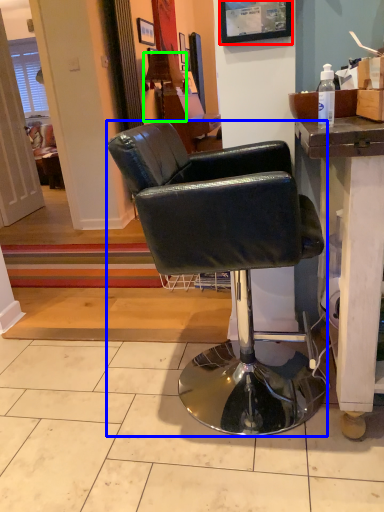
Question: Estimate the real-world distances between objects in this image. Which object is farther from picture frame (highlighted by a red box), chair (highlighted by a blue box) or lamp (highlighted by a green box)?

Choices:
 (A) chair
 (B) lamp

Answer: (B)